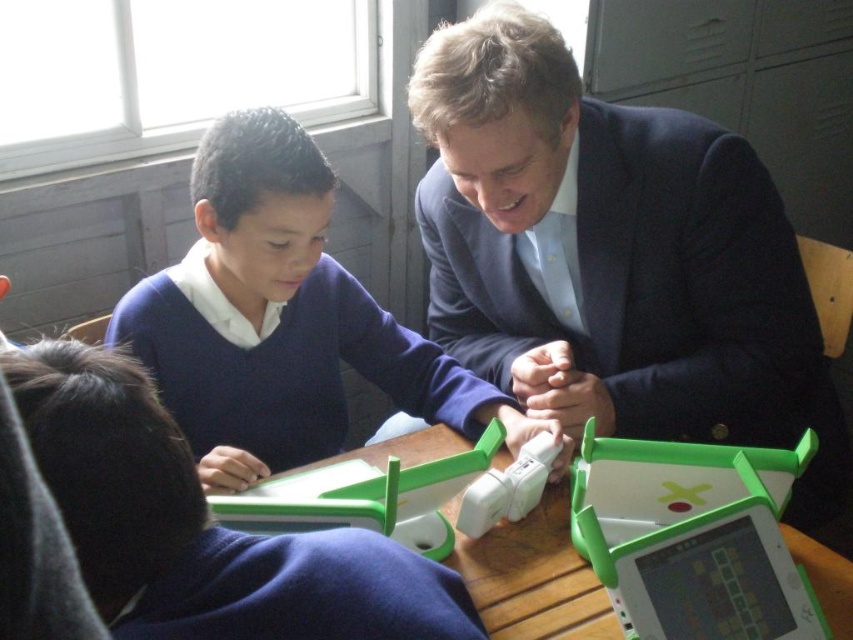
Who is positioned more to the right, dark blue sweater at upper center or wooden table at center?

wooden table at center

Does dark blue sweater at upper center have a greater height compared to wooden table at center?

Correct, dark blue sweater at upper center is much taller as wooden table at center.

Where is `dark blue sweater at upper center`? This screenshot has width=853, height=640. dark blue sweater at upper center is located at coordinates (282, 320).

Who is more distant from viewer, (509,93) or (262,136)?

Positioned behind is point (262,136).

Who is more forward, (560,316) or (329,342)?

Point (560,316) is more forward.

This screenshot has width=853, height=640. I want to click on dark blue suit at center, so click(x=613, y=257).

You are a GUI agent. You are given a task and a screenshot of the screen. Output one action in this format:
    pyautogui.click(x=<x>, y=<y>)
    Task: Click on the dark blue suit at center
    This screenshot has width=853, height=640.
    Given the screenshot: What is the action you would take?
    pyautogui.click(x=613, y=257)

Does dark blue sweater at upper center have a lesser width compared to matte green plastic tablet at lower left?

Incorrect, dark blue sweater at upper center's width is not less than matte green plastic tablet at lower left's.

Between dark blue sweater at upper center and matte green plastic tablet at lower left, which one has more height?

With more height is dark blue sweater at upper center.

Between point (196, 202) and point (374, 564), which one is positioned in front?

Point (374, 564)

I want to click on dark blue sweater at upper center, so click(x=282, y=320).